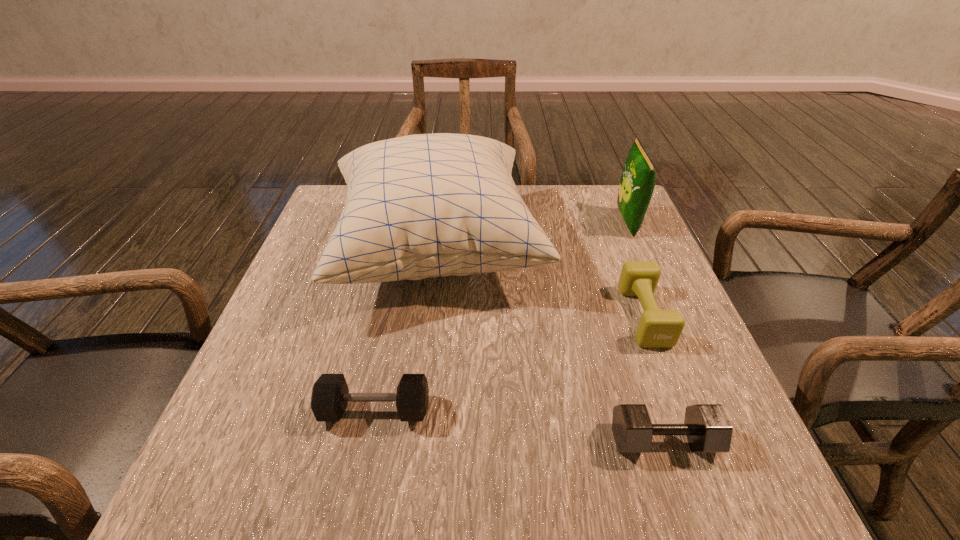
Where is `free region at the left edge`? This screenshot has width=960, height=540. free region at the left edge is located at coordinates (285, 328).

The height and width of the screenshot is (540, 960). In the image, there is a desktop. What are the coordinates of `free space at the right edge` in the screenshot? It's located at (632, 305).

Locate an element on the screen. free space at the far left corner of the desktop is located at coordinates (332, 230).

The image size is (960, 540). I want to click on free space that is in between the tallest object and the leftmost dumbbell, so click(x=406, y=329).

Where is `unoccupied position between the leftmost dumbbell and the cushion`? The image size is (960, 540). unoccupied position between the leftmost dumbbell and the cushion is located at coordinates (406, 329).

Locate an element on the screen. The width and height of the screenshot is (960, 540). empty location between the leftmost dumbbell and the farthest dumbbell is located at coordinates (510, 363).

Identify the location of empty location between the farthest dumbbell and the leftmost dumbbell. (510, 363).

You are a GUI agent. You are given a task and a screenshot of the screen. Output one action in this format:
    pyautogui.click(x=<x>, y=<y>)
    Task: Click on the object that is the closest to the farthest dumbbell
    This screenshot has width=960, height=540.
    Given the screenshot: What is the action you would take?
    pyautogui.click(x=707, y=428)

The width and height of the screenshot is (960, 540). I want to click on object that stands as the fourth closest to the crisp (potato chip), so click(330, 394).

Point out which dumbbell is positioned as the second nearest to the farthest dumbbell. Please provide its 2D coordinates. Your answer should be formatted as a tuple, i.e. [(x, y)], where the tuple contains the x and y coordinates of a point satisfying the conditions above.

[(330, 394)]